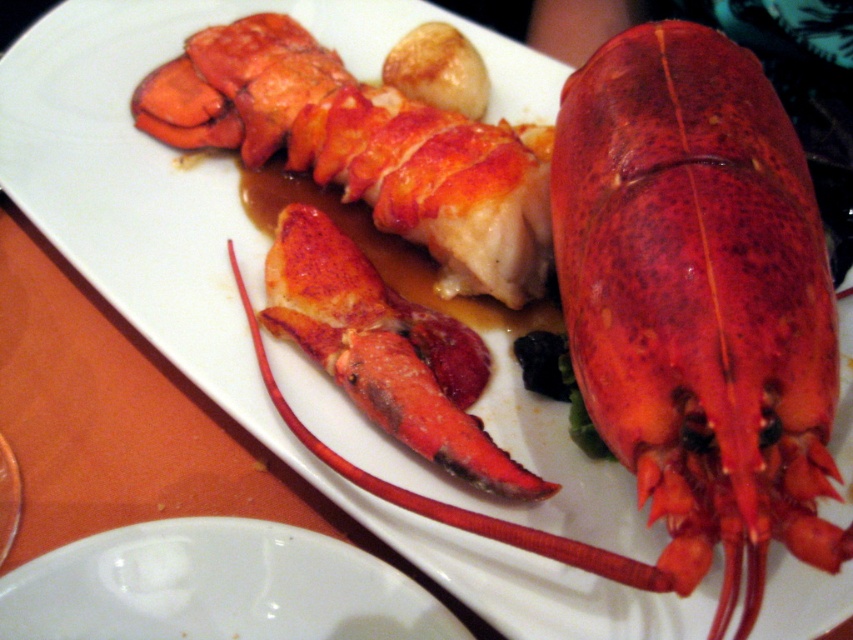
Which is in front, point (654, 24) or point (44, 616)?

Point (44, 616) is in front.

Between shiny red lobster at center and white glossy plate at lower center, which one has more height?

With more height is shiny red lobster at center.

The image size is (853, 640). Describe the element at coordinates (740, 148) in the screenshot. I see `shiny red lobster at center` at that location.

Identify the location of shiny red lobster at center. The width and height of the screenshot is (853, 640). (740, 148).